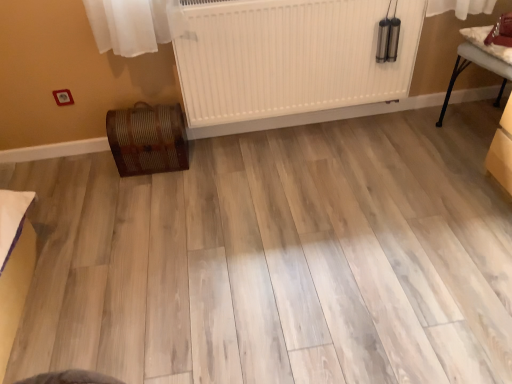
Describe the element at coordinates (289, 61) in the screenshot. This screenshot has width=512, height=384. I see `white matte radiator at upper center` at that location.

Where is `white matte radiator at upper center`? Image resolution: width=512 pixels, height=384 pixels. white matte radiator at upper center is located at coordinates (289, 61).

In order to face white matte radiator at upper center, should I rotate leftwards or rightwards?

To align with it, rotate right about 6.489°.

Identify the location of white matte radiator at upper center. The width and height of the screenshot is (512, 384). (289, 61).